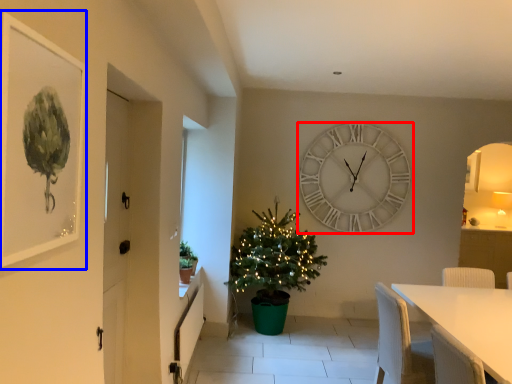
Question: Which of the following is the farthest to the observer, wall clock (highlighted by a red box) or picture frame (highlighted by a blue box)?

Choices:
 (A) wall clock
 (B) picture frame

Answer: (A)